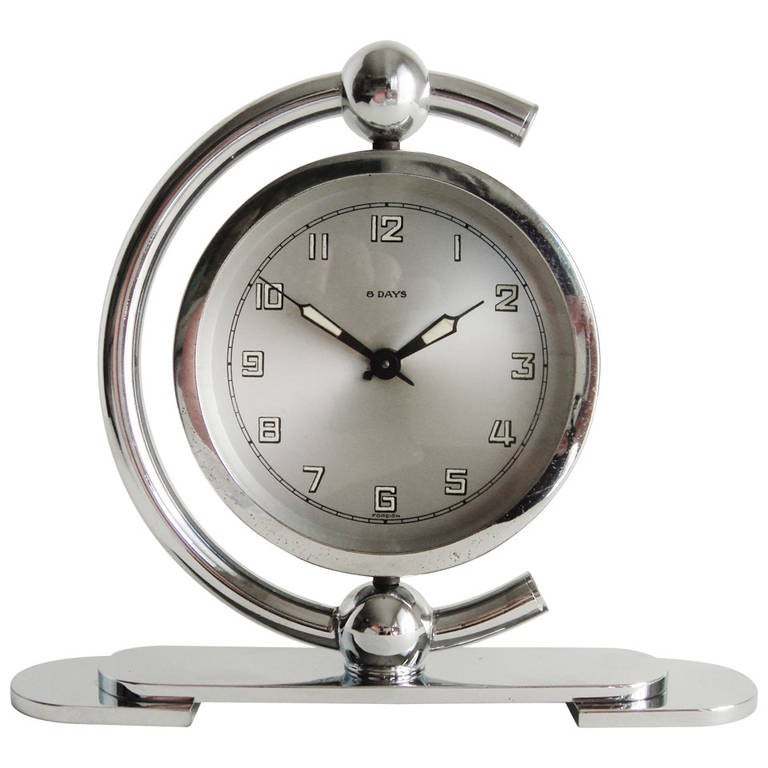
Locate an element on the screen. Image resolution: width=768 pixels, height=768 pixels. clock is located at coordinates (421, 454).